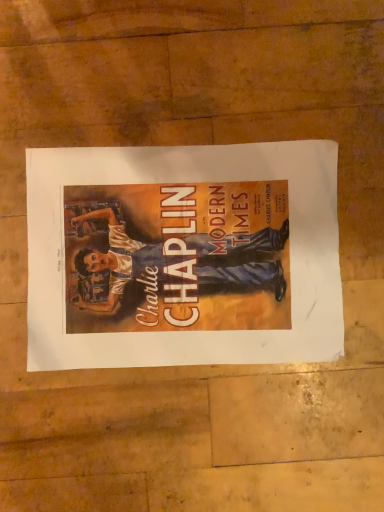
The image size is (384, 512). I want to click on matte paper poster at center, so click(x=183, y=255).

What do you see at coordinates (183, 255) in the screenshot? Image resolution: width=384 pixels, height=512 pixels. I see `matte paper poster at center` at bounding box center [183, 255].

Where is `matte paper poster at center`? This screenshot has width=384, height=512. matte paper poster at center is located at coordinates (183, 255).